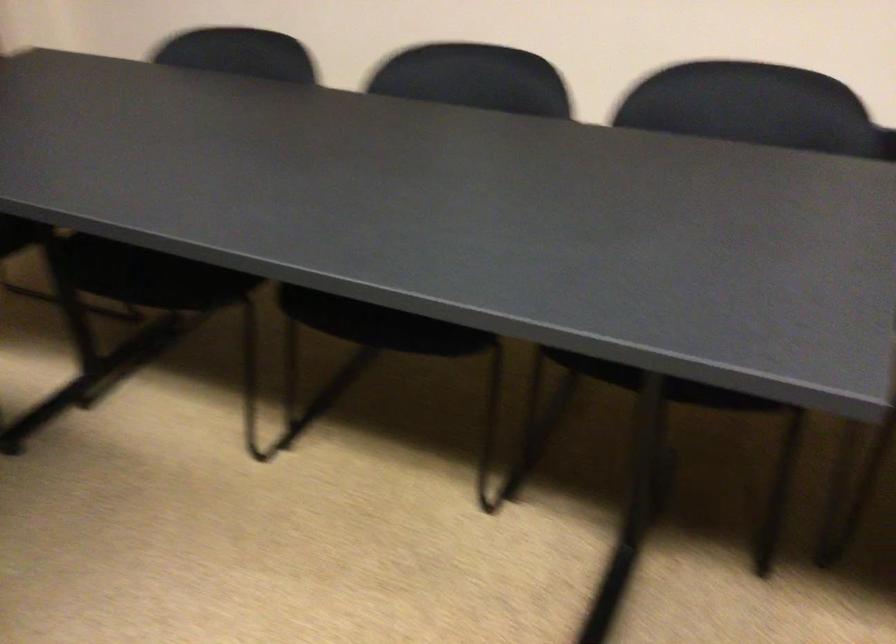
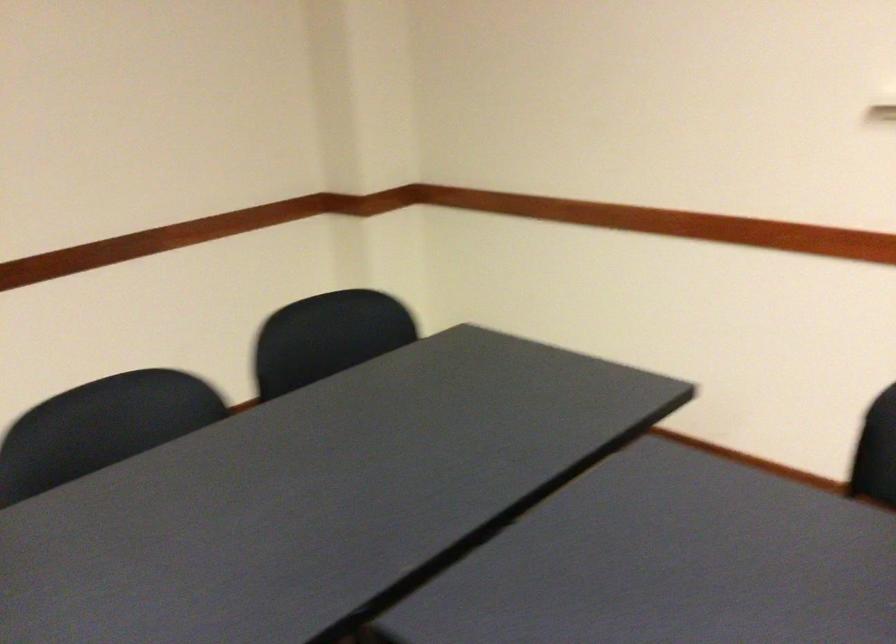
Question: The camera is either moving clockwise (left) or counter-clockwise (right) around the object. The first image is from the beginning of the video and the second image is from the end. Is the camera moving left or right when shooting the video?

Choices:
 (A) Left
 (B) Right

Answer: (A)